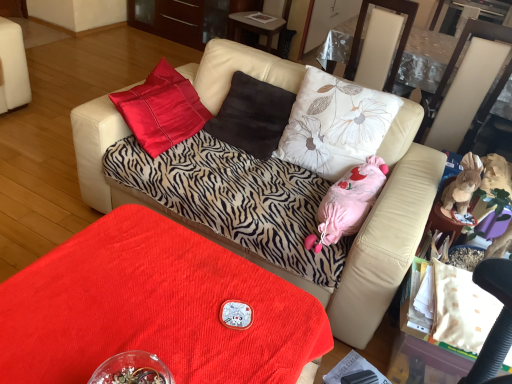
Question: Would you say pink fabric stuffed toy at center, the first animal positioned from the left, contains transparent plastic glass table at upper right?

Choices:
 (A) no
 (B) yes

Answer: (A)

Question: Is pink fabric stuffed toy at center, marked as the 2th animal in a right-to-left arrangement, smaller than transparent plastic glass table at upper right?

Choices:
 (A) yes
 (B) no

Answer: (A)

Question: From a real-world perspective, is pink fabric stuffed toy at center, marked as the 2th animal in a right-to-left arrangement, positioned over transparent plastic glass table at upper right based on gravity?

Choices:
 (A) yes
 (B) no

Answer: (B)

Question: Is pink fabric stuffed toy at center, marked as the 2th animal in a right-to-left arrangement, thinner than transparent plastic glass table at upper right?

Choices:
 (A) yes
 (B) no

Answer: (B)

Question: Is pink fabric stuffed toy at center, the first animal positioned from the left, shorter than transparent plastic glass table at upper right?

Choices:
 (A) yes
 (B) no

Answer: (A)

Question: Is velvet red table at lower center inside the boundaries of floral fabric pillow at center, which is the 1th pillow in right-to-left order, or outside?

Choices:
 (A) inside
 (B) outside

Answer: (B)

Question: Is velvet red table at lower center taller or shorter than floral fabric pillow at center, positioned as the second pillow in left-to-right order?

Choices:
 (A) short
 (B) tall

Answer: (A)

Question: In the image, is velvet red table at lower center positioned in front of or behind floral fabric pillow at center, which is the 1th pillow in right-to-left order?

Choices:
 (A) behind
 (B) front

Answer: (B)

Question: In terms of width, does velvet red table at lower center look wider or thinner when compared to floral fabric pillow at center, which is the 1th pillow in right-to-left order?

Choices:
 (A) thin
 (B) wide

Answer: (B)

Question: From a real-world perspective, is brown plush toy at right, which is the 1th animal in right-to-left order, above or below brown suede pillow at center, which appears as the second pillow when viewed from the right?

Choices:
 (A) below
 (B) above

Answer: (B)

Question: Is brown plush toy at right, which is the 1th animal in right-to-left order, taller or shorter than brown suede pillow at center, which appears as the second pillow when viewed from the right?

Choices:
 (A) tall
 (B) short

Answer: (B)

Question: Is brown plush toy at right, which is the 1th animal in right-to-left order, in front of or behind brown suede pillow at center, positioned as the first pillow in left-to-right order, in the image?

Choices:
 (A) front
 (B) behind

Answer: (A)

Question: From the image's perspective, relative to brown suede pillow at center, positioned as the first pillow in left-to-right order, is brown plush toy at right, which is the 1th animal in right-to-left order, above or below?

Choices:
 (A) above
 (B) below

Answer: (B)

Question: In terms of height, does pink fabric stuffed toy at center, marked as the 2th animal in a right-to-left arrangement, look taller or shorter compared to zebra-patterned fabric couch at center?

Choices:
 (A) tall
 (B) short

Answer: (B)

Question: Is pink fabric stuffed toy at center, the first animal positioned from the left, inside or outside of zebra-patterned fabric couch at center?

Choices:
 (A) inside
 (B) outside

Answer: (A)